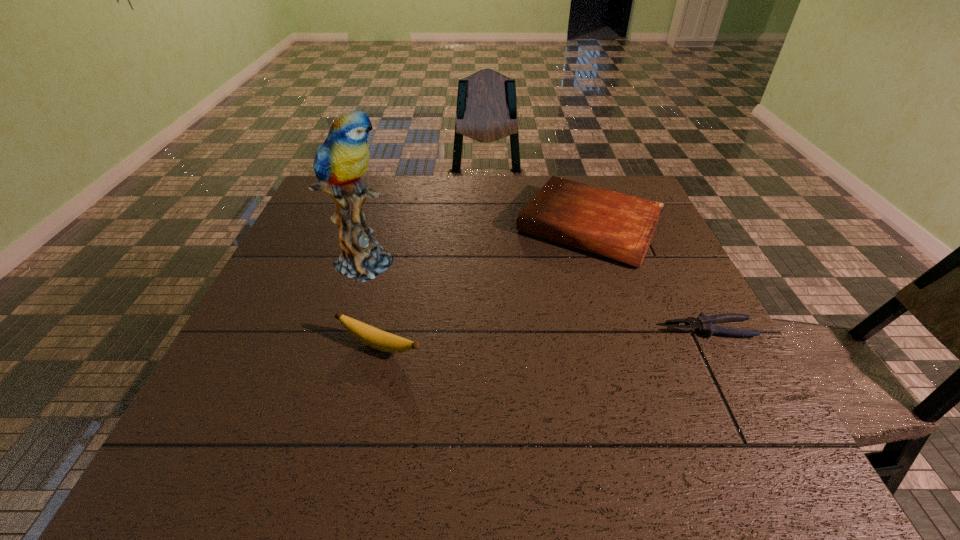
You are a GUI agent. You are given a task and a screenshot of the screen. Output one action in this format:
    pyautogui.click(x=<x>, y=<y>)
    Task: Click on the free space on the desktop that is between the banana and the pliers and is positioned on the spine side of the Bible
    The width and height of the screenshot is (960, 540).
    Given the screenshot: What is the action you would take?
    pyautogui.click(x=516, y=339)

Find the location of a particular element. free space on the desktop that is between the banana and the pliers and is positioned on the face of the tallest object is located at coordinates (588, 335).